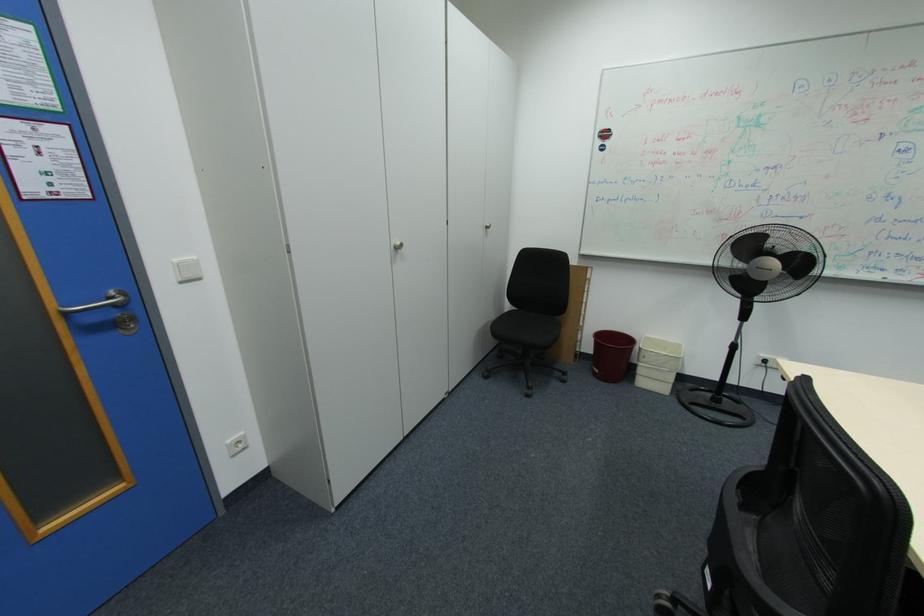
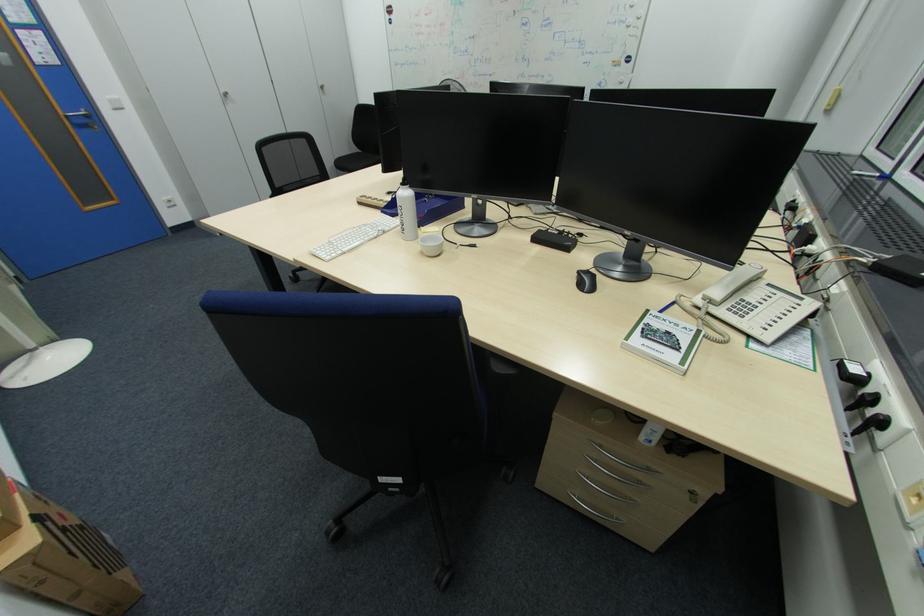
Which direction would the cameraman need to move to produce the second image?

The movement direction of the cameraman is right, backward.